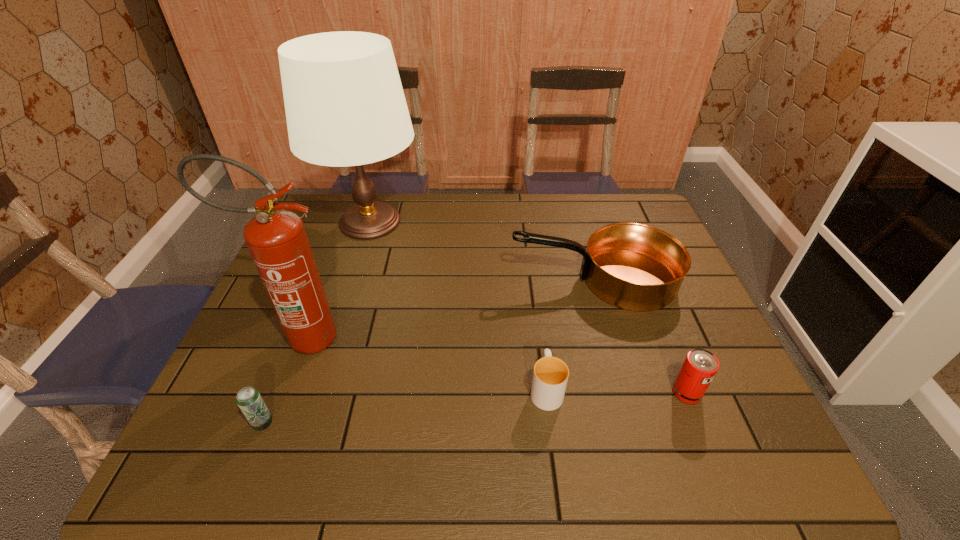
What are the coordinates of `lamp` in the screenshot? It's located at (345, 106).

The image size is (960, 540). What are the coordinates of `the third farthest object` in the screenshot? It's located at (277, 240).

The width and height of the screenshot is (960, 540). What are the coordinates of `frying pan` in the screenshot? It's located at (632, 266).

Locate an element on the screen. The width and height of the screenshot is (960, 540). can is located at coordinates (700, 366).

You are a GUI agent. You are given a task and a screenshot of the screen. Output one action in this format:
    pyautogui.click(x=<x>, y=<y>)
    Task: Click on the beer can
    
    Given the screenshot: What is the action you would take?
    pyautogui.click(x=249, y=400)

At what (x,y) coordinates should I click in order to perform the action: click on cup. Please return your answer as a coordinate pair (x, y). This screenshot has height=540, width=960. Looking at the image, I should click on (550, 376).

Find the location of `free space located on the front of the lamp`. free space located on the front of the lamp is located at coordinates (354, 270).

This screenshot has width=960, height=540. I want to click on free space located 0.280m from the nozzle of the third farthest object, so click(458, 338).

Find the location of a particular element. vacant space situated on the handle side of the frying pan is located at coordinates (458, 280).

Where is `vacant space located 0.100m on the handle side of the frying pan`? vacant space located 0.100m on the handle side of the frying pan is located at coordinates (475, 280).